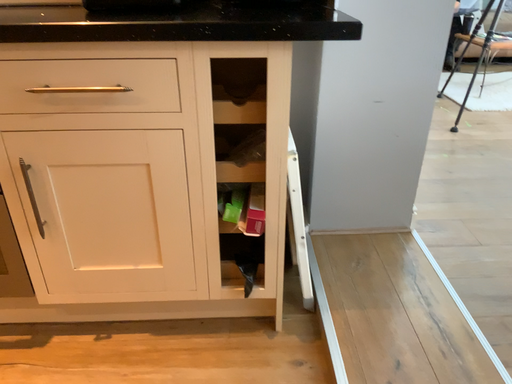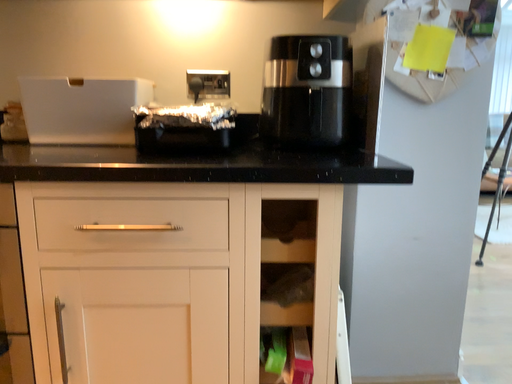
Question: How did the camera likely rotate when shooting the video?

Choices:
 (A) rotated upward
 (B) rotated downward

Answer: (A)